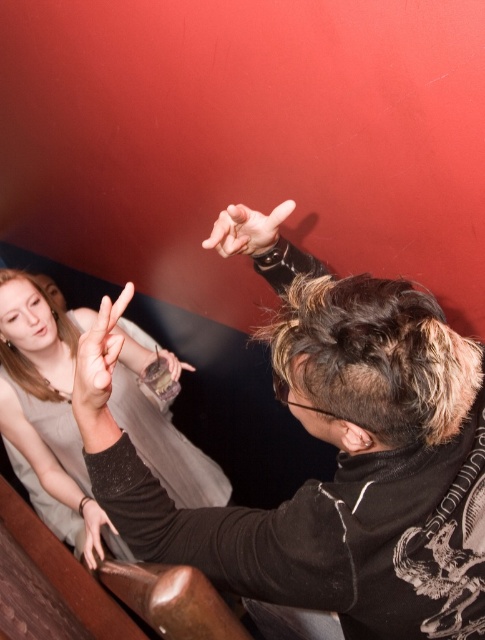
Can you confirm if black matte jacket at upper center is positioned above matte black hand at upper center?

Actually, black matte jacket at upper center is below matte black hand at upper center.

Does black matte jacket at upper center appear on the right side of matte black hand at upper center?

Yes, black matte jacket at upper center is to the right of matte black hand at upper center.

Identify the location of black matte jacket at upper center. The image size is (485, 640). 339,467.

Who is lower down, matte black dress at upper left or smooth skin hand at lower left?

smooth skin hand at lower left is below.

Looking at this image, who is higher up, matte black dress at upper left or smooth skin hand at lower left?

matte black dress at upper left is above.

Between point (219, 490) and point (82, 499), which one is positioned behind?

Positioned behind is point (219, 490).

What are the coordinates of `matte black dress at upper left` in the screenshot? It's located at (41, 385).

Does matte black hand at upper center appear on the right side of smooth skin hand at lower left?

Correct, you'll find matte black hand at upper center to the right of smooth skin hand at lower left.

Is point (229, 214) more distant than point (100, 544)?

No, it is not.

Identify the location of matte black hand at upper center. (246, 228).

Identify the location of matte black hand at upper center. (246, 228).